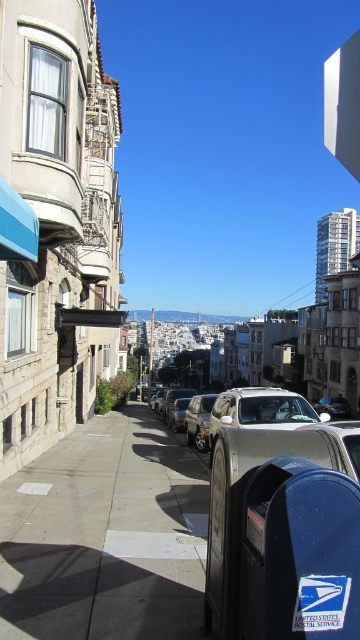
Between gray concrete sidewalk at lower left and blue metallic mailbox at lower right, which one has less height?

With less height is blue metallic mailbox at lower right.

Who is more distant from viewer, (141,628) or (358,582)?

Point (141,628)

The height and width of the screenshot is (640, 360). What are the coordinates of `gray concrete sidewalk at lower left` in the screenshot? It's located at (105, 536).

Can you confirm if satin silver suv at center is wider than metallic silver car at center?

Indeed, satin silver suv at center has a greater width compared to metallic silver car at center.

Is satin silver suv at center in front of metallic silver car at center?

Yes, satin silver suv at center is in front of metallic silver car at center.

Is point (231, 392) farther from viewer compared to point (338, 412)?

No, it is not.

This screenshot has width=360, height=640. What are the coordinates of `satin silver suv at center` in the screenshot? It's located at (259, 410).

Between point (204, 435) and point (321, 406), which one is positioned in front?

Point (204, 435)

Does shiny silver sedan at center have a greater width compared to metallic silver car at center?

Incorrect, shiny silver sedan at center's width does not surpass metallic silver car at center's.

Describe the element at coordinates (199, 420) in the screenshot. This screenshot has height=640, width=360. I see `shiny silver sedan at center` at that location.

Where is `shiny silver sedan at center`? shiny silver sedan at center is located at coordinates (199, 420).